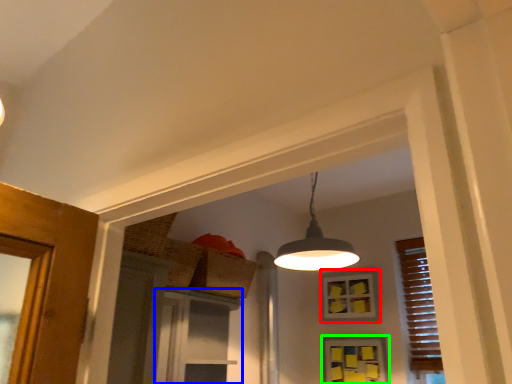
Question: Which object is the farthest from window (highlighted by a red box)? Choose among these: screen door (highlighted by a blue box) or window (highlighted by a green box).

Choices:
 (A) screen door
 (B) window

Answer: (A)